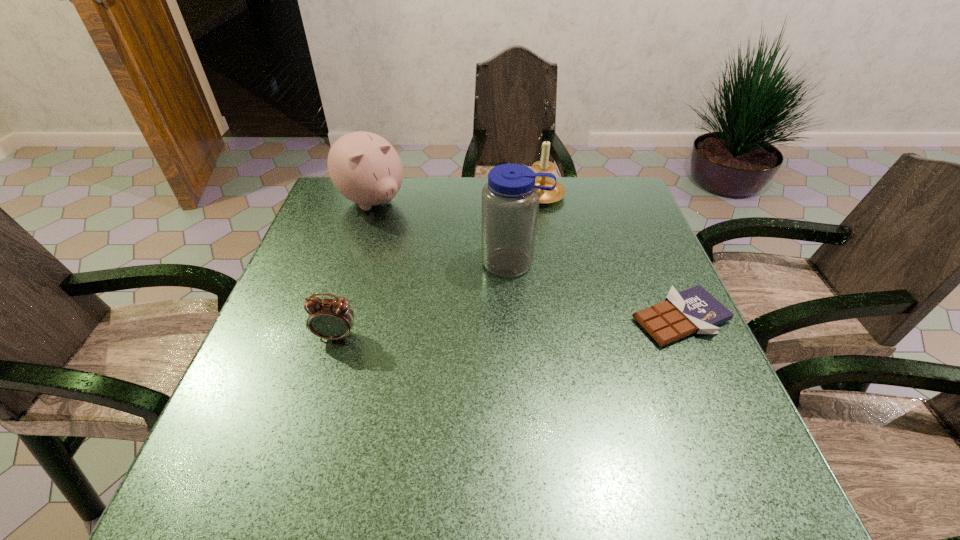
I want to click on free space on the desktop that is between the fourth tallest object and the shortest object and is positioned at the snout of the piggy bank, so click(503, 328).

Locate an element on the screen. Image resolution: width=960 pixels, height=540 pixels. vacant space on the desktop that is between the second shortest object and the shortest object and is positioned with a handle on the side of the candle holder is located at coordinates (473, 329).

Where is `vacant spot on the desktop that is between the fourth tallest object and the shortest object and is positioned with a carrying loop on the side of the third farthest object`? This screenshot has width=960, height=540. vacant spot on the desktop that is between the fourth tallest object and the shortest object and is positioned with a carrying loop on the side of the third farthest object is located at coordinates (496, 328).